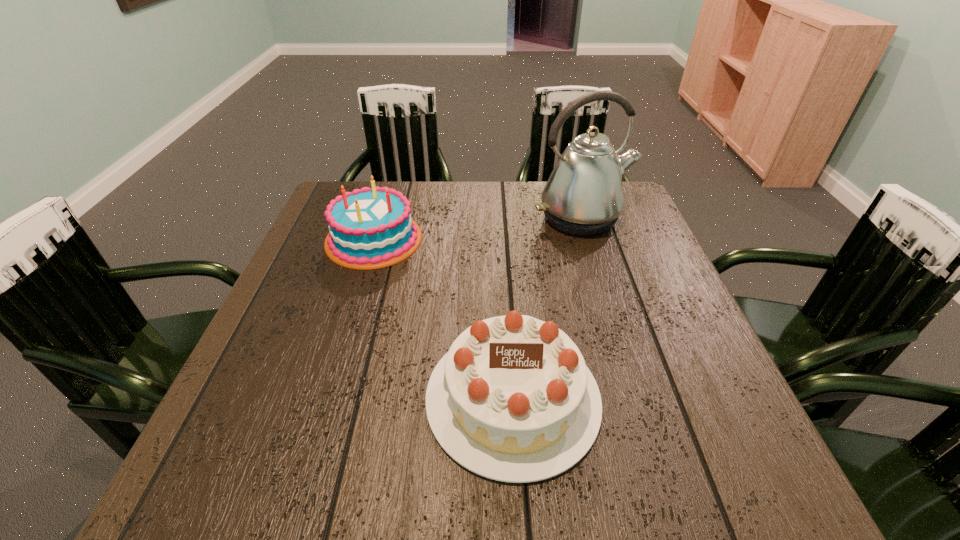
The height and width of the screenshot is (540, 960). Find the location of `the tallest object`. the tallest object is located at coordinates (x=583, y=196).

You are a GUI agent. You are given a task and a screenshot of the screen. Output one action in this format:
    pyautogui.click(x=<x>, y=<y>)
    Task: Click on the left birthday cake
    
    Given the screenshot: What is the action you would take?
    pyautogui.click(x=367, y=229)

Locate an element on the screen. Image resolution: width=960 pixels, height=540 pixels. the farther birthday cake is located at coordinates (367, 229).

The image size is (960, 540). What are the coordinates of `the nearer birthday cake` in the screenshot? It's located at tap(512, 400).

At what (x,y) coordinates should I click in order to perform the action: click on the right birthday cake. Please return your answer as a coordinate pair (x, y). Looking at the image, I should click on (512, 400).

Find the location of a particular element. vacant area situated on the front of the tallest object is located at coordinates (608, 301).

At what (x,y) coordinates should I click in order to perform the action: click on free space located 0.360m on the front of the left birthday cake. Please return your answer as a coordinate pair (x, y). This screenshot has width=960, height=540. Looking at the image, I should click on pos(324,401).

Identify the location of free space located 0.150m on the left of the nearer birthday cake. The height and width of the screenshot is (540, 960). (342, 398).

At what (x,y) coordinates should I click in order to perform the action: click on kettle that is at the far edge. Please return your answer as a coordinate pair (x, y). The width and height of the screenshot is (960, 540). Looking at the image, I should click on (583, 196).

Identify the location of birthday cake at the far edge. (367, 229).